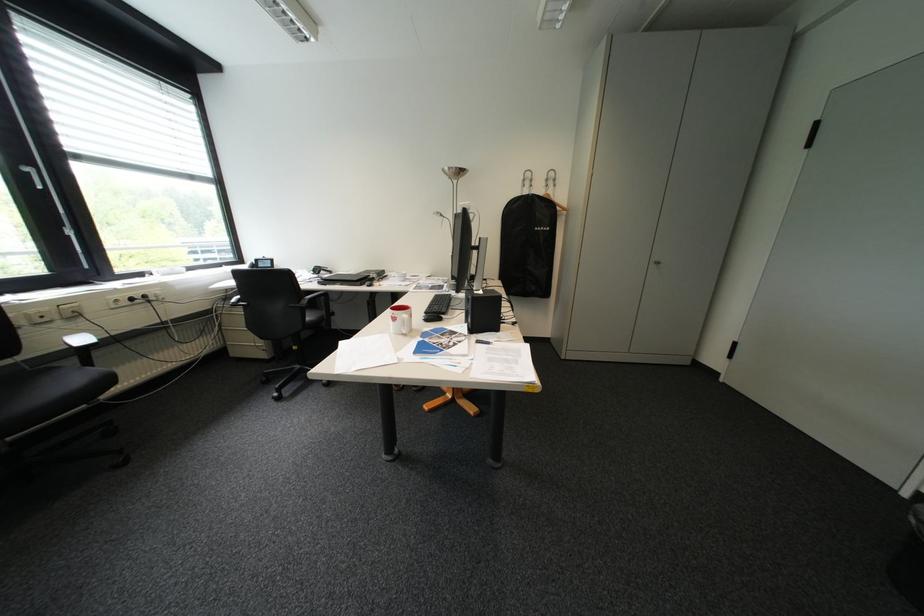
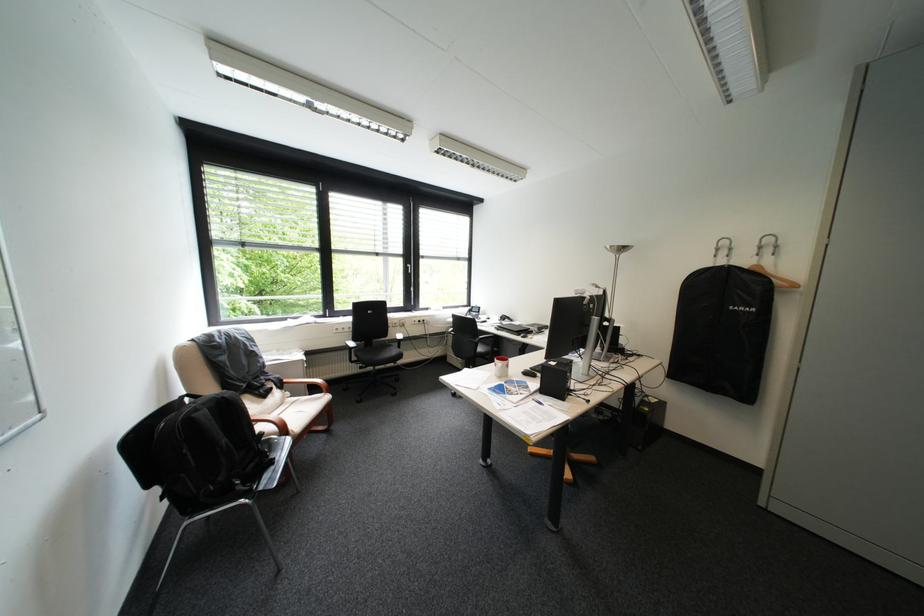
The point at (407, 320) is marked in the first image. Where is the corresponding point in the second image?

(507, 365)